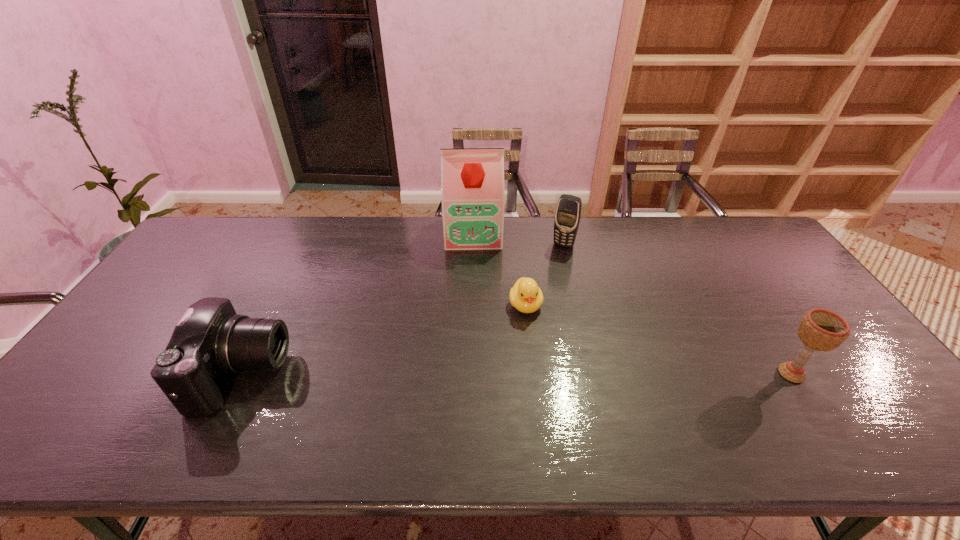
Identify the location of free space located 0.190m on the beak of the shortest object. The image size is (960, 540). (540, 376).

Image resolution: width=960 pixels, height=540 pixels. I want to click on free space located on the beak of the shortest object, so click(x=546, y=407).

I want to click on free region located 0.080m on the front face of the cellular telephone, so click(x=553, y=263).

Image resolution: width=960 pixels, height=540 pixels. I want to click on vacant space located 0.220m on the front face of the cellular telephone, so click(x=540, y=289).

Find the location of a particular element. The width and height of the screenshot is (960, 540). free spot located on the front face of the cellular telephone is located at coordinates (532, 307).

The width and height of the screenshot is (960, 540). What are the coordinates of `blank space located with the cap open on the soya milk` in the screenshot? It's located at (474, 279).

At what (x,y) coordinates should I click in order to perform the action: click on free location located with the cap open on the soya milk. Please return your answer as a coordinate pair (x, y). Looking at the image, I should click on [475, 314].

Identify the location of vacant space located with the cap open on the soya milk. The width and height of the screenshot is (960, 540). (474, 284).

This screenshot has height=540, width=960. Find the location of `cellular telephone present at the far edge`. cellular telephone present at the far edge is located at coordinates (568, 212).

The height and width of the screenshot is (540, 960). Find the location of `soya milk situated at the far edge`. soya milk situated at the far edge is located at coordinates (472, 180).